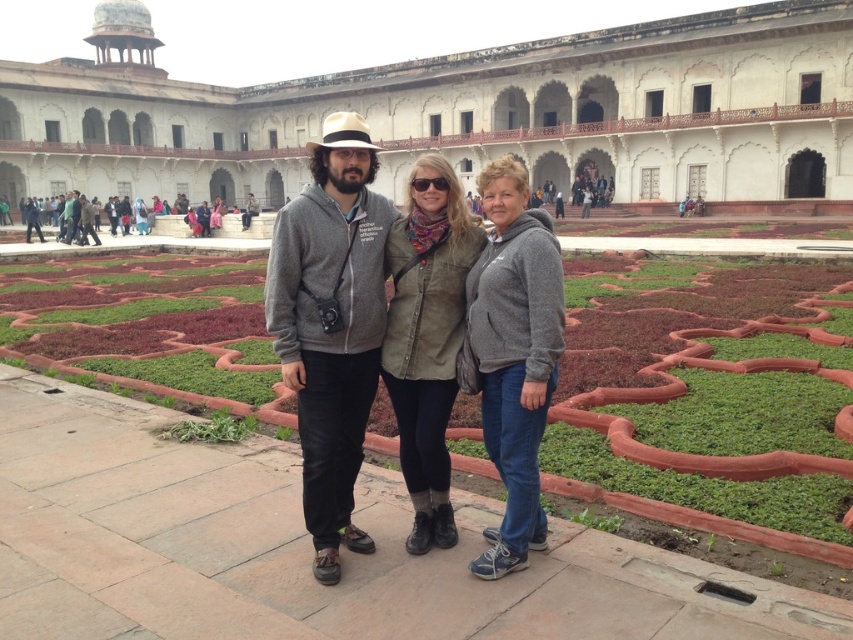
Question: Is green grass at center above olive-green fabric jacket at center?

Choices:
 (A) no
 (B) yes

Answer: (B)

Question: Can you confirm if gray hoodie at center is positioned to the left of olive-green fabric jacket at center?

Choices:
 (A) yes
 (B) no

Answer: (A)

Question: Which object is positioned closest to the white stone palace at center?

Choices:
 (A) green grass at center
 (B) olive-green fabric jacket at center
 (C) gray hoodie at center

Answer: (A)

Question: Considering the relative positions of white stone palace at center and olive-green fabric jacket at center in the image provided, where is white stone palace at center located with respect to olive-green fabric jacket at center?

Choices:
 (A) right
 (B) left

Answer: (B)

Question: Which point is closer to the camera?

Choices:
 (A) green grass at center
 (B) gray cotton hoodie at center
 (C) white stone palace at center
 (D) gray fleece jacket at center

Answer: (A)

Question: Which of these objects is positioned farthest from the green grass at center?

Choices:
 (A) gray fleece jacket at center
 (B) gray cotton hoodie at center
 (C) gray hoodie at center

Answer: (A)